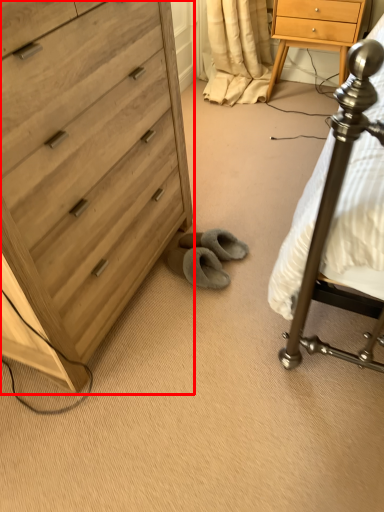
Question: From the image's perspective, where is chest of drawers (annotated by the red box) located in relation to nightstand in the image?

Choices:
 (A) below
 (B) above

Answer: (A)